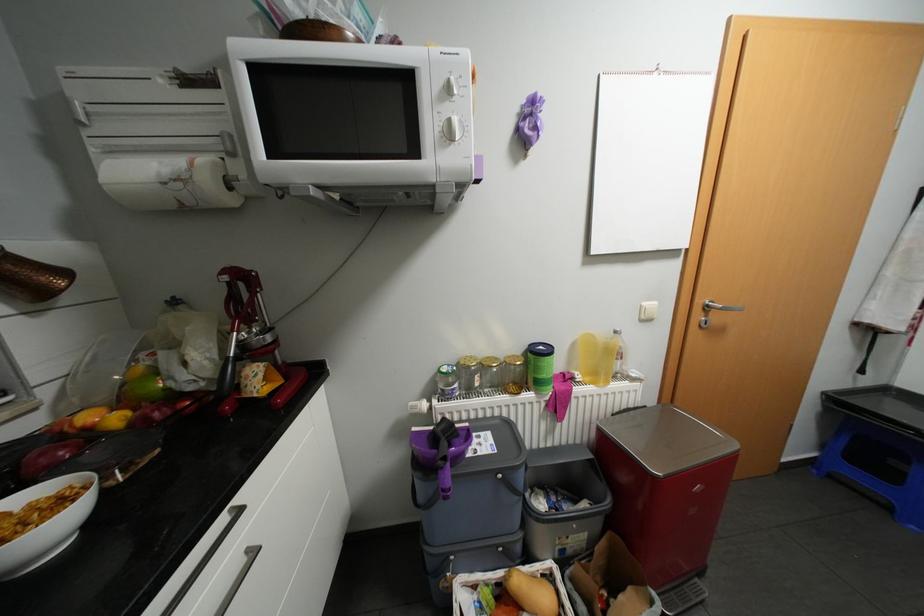
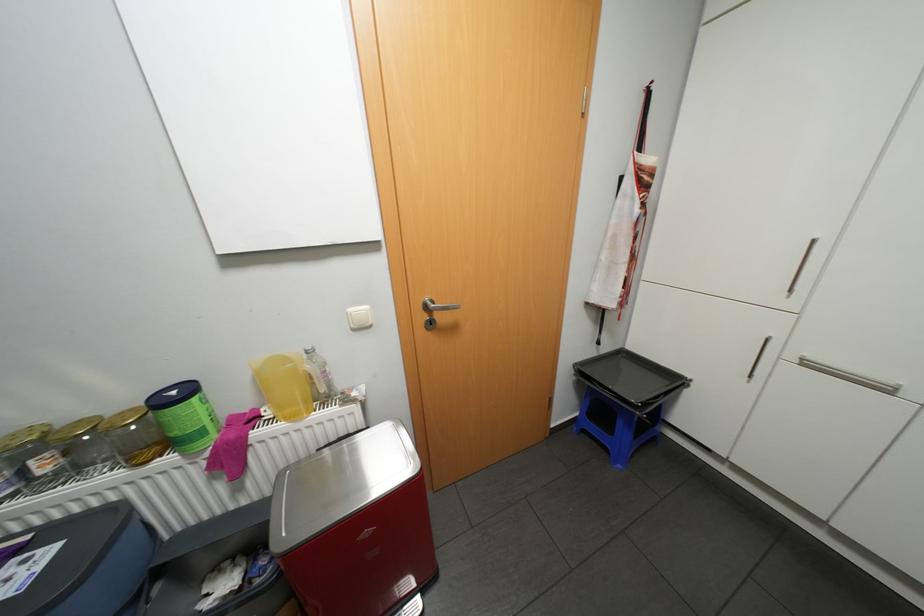
Question: The images are taken continuously from a first-person perspective. In which direction are you moving?

Choices:
 (A) Left
 (B) Right
 (C) Forward
 (D) Backward

Answer: (B)